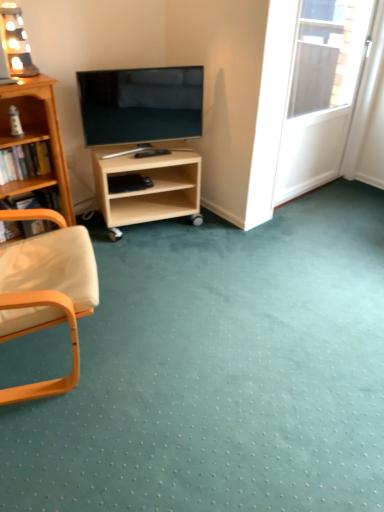
I want to click on vacant area that is in front of wooden armchair at left, so click(77, 442).